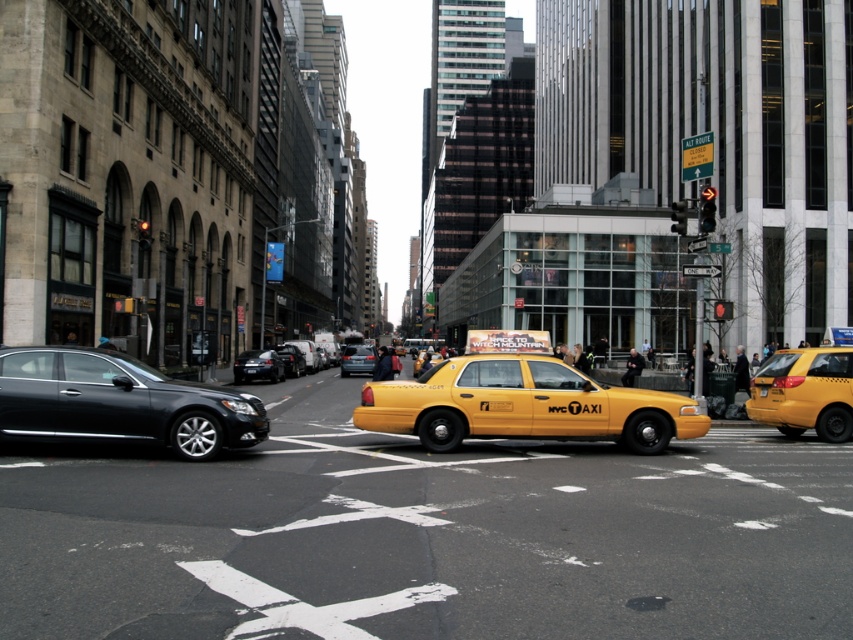
Does point (460, 392) come in front of point (97, 406)?

No.

This screenshot has width=853, height=640. What do you see at coordinates (524, 404) in the screenshot?
I see `yellow matte taxi at center` at bounding box center [524, 404].

Find the location of a particular element. The image size is (853, 640). yellow matte taxi at center is located at coordinates (524, 404).

Which is more to the right, yellow matte taxi at right or shiny black sedan at center-left?

From the viewer's perspective, yellow matte taxi at right appears more on the right side.

Is yellow matte taxi at right to the right of shiny black sedan at center-left from the viewer's perspective?

Correct, you'll find yellow matte taxi at right to the right of shiny black sedan at center-left.

The height and width of the screenshot is (640, 853). What are the coordinates of `yellow matte taxi at right` in the screenshot? It's located at (805, 392).

Is point (364, 349) positioned in front of point (291, 364)?

No, it is not.

Based on the photo, which is more to the right, metallic gray sedan at center or shiny black sedan at center?

metallic gray sedan at center is more to the right.

Is point (355, 362) behind point (297, 353)?

No.

Find the location of a particular element. The width and height of the screenshot is (853, 640). metallic gray sedan at center is located at coordinates (357, 358).